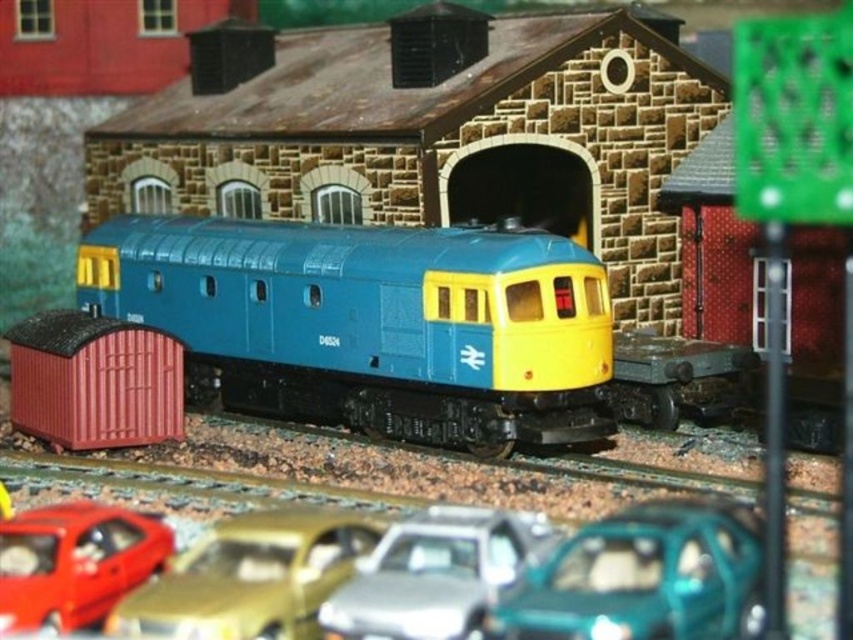
Question: Which is farther from the teal glossy car at lower center?

Choices:
 (A) blue plastic train at center
 (B) metallic silver car at center
 (C) shiny red car at lower left

Answer: (A)

Question: Is blue plastic train at center to the right of matte plastic container at lower left from the viewer's perspective?

Choices:
 (A) no
 (B) yes

Answer: (B)

Question: Which point is closer to the camera?

Choices:
 (A) (274, 513)
 (B) (126, 536)
 (C) (169, 412)

Answer: (B)

Question: Considering the relative positions of gold metallic car at lower center and shiny red car at lower left in the image provided, where is gold metallic car at lower center located with respect to shiny red car at lower left?

Choices:
 (A) below
 (B) above

Answer: (A)

Question: Which object is positioned farthest from the shiny red car at lower left?

Choices:
 (A) gold metallic car at lower center
 (B) blue plastic train at center
 (C) teal glossy car at lower center

Answer: (B)

Question: Is blue plastic train at center below gold metallic car at lower center?

Choices:
 (A) no
 (B) yes

Answer: (A)